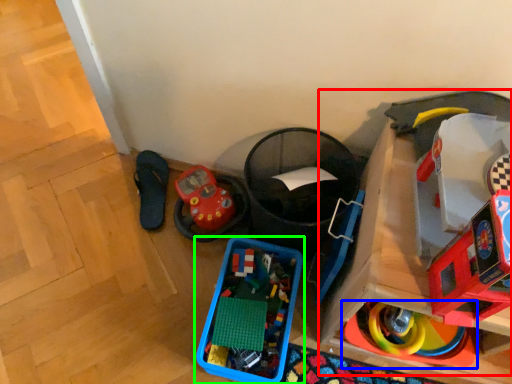
Question: Which is farther away from toy (highlighted by a red box)? toy (highlighted by a blue box) or toy (highlighted by a green box)?

Choices:
 (A) toy
 (B) toy

Answer: (B)